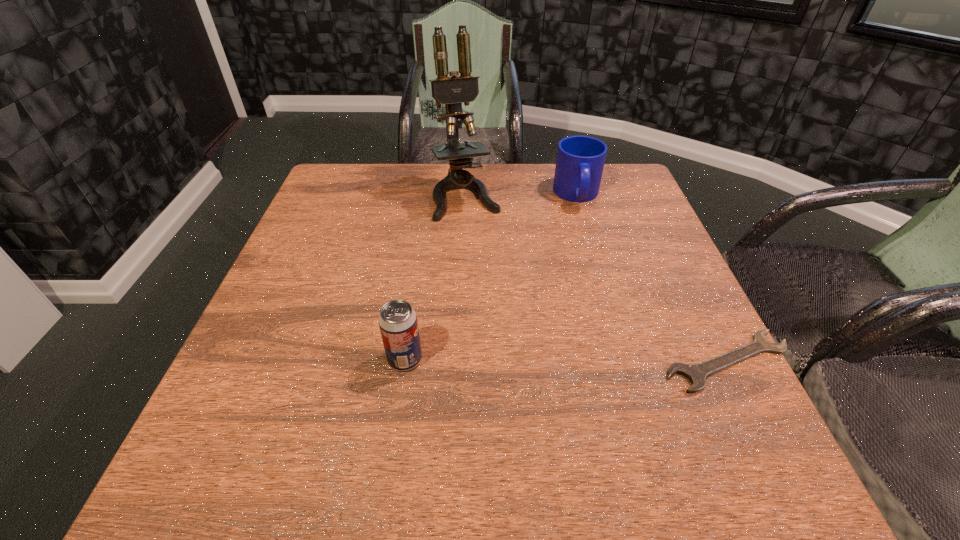
In order to click on beer can in this screenshot , I will do `click(398, 324)`.

Find the location of a particular element. Image resolution: width=960 pixels, height=540 pixels. the rightmost object is located at coordinates (696, 373).

The image size is (960, 540). Find the location of `the shortest object`. the shortest object is located at coordinates (696, 373).

The width and height of the screenshot is (960, 540). In order to click on the tallest object in this screenshot , I will do pyautogui.click(x=452, y=91).

Where is `the third object from left to right`? The height and width of the screenshot is (540, 960). the third object from left to right is located at coordinates (580, 160).

This screenshot has height=540, width=960. I want to click on vacant position located on the right of the beer can, so click(x=542, y=359).

Image resolution: width=960 pixels, height=540 pixels. I want to click on vacant space located 0.400m on the back of the shortest object, so click(x=654, y=213).

This screenshot has height=540, width=960. Find the location of `free spot located 0.170m at the eyepieces of the tallest object`. free spot located 0.170m at the eyepieces of the tallest object is located at coordinates (489, 264).

In order to click on vacant space situated at the eyepieces of the tallest object in this screenshot , I will do `click(492, 273)`.

This screenshot has height=540, width=960. Find the location of `free point located 0.300m at the eyepieces of the tallest object`. free point located 0.300m at the eyepieces of the tallest object is located at coordinates (504, 305).